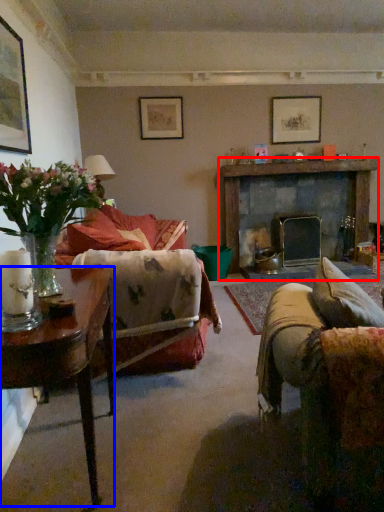
Question: Among these objects, which one is nearest to the camera, fireplace (highlighted by a red box) or table (highlighted by a blue box)?

Choices:
 (A) fireplace
 (B) table

Answer: (B)